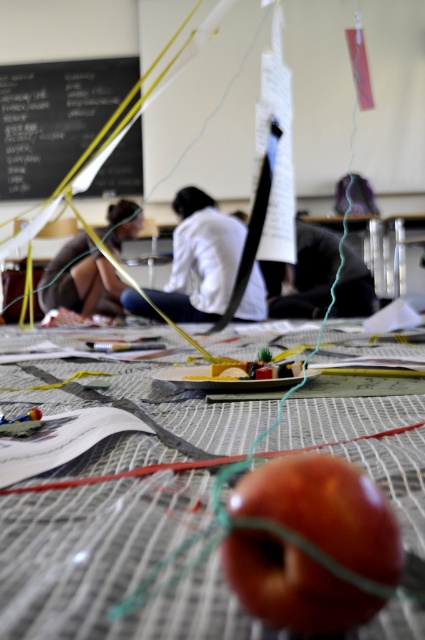
You are a student in the classroom. You need to place a book on the table so that it is between the glossy red apple at center and the black chalkboard at upper left. Is this possible?

The glossy red apple at center is not as tall as the black chalkboard at upper left, so placing a book between them on the table is possible since the apple is shorter than the chalkboard.

You are standing in the classroom and want to pick up an item from the table. There are two points marked on the table surface. Which point is closer to you, point (393, 544) or point (64, 132)?

Point (393, 544) is closer to the viewer than point (64, 132).